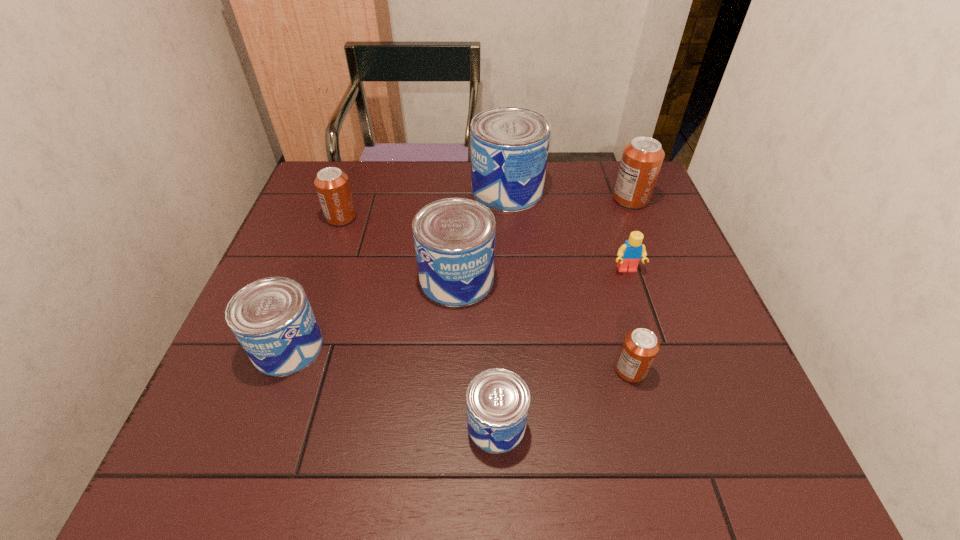
Choose which orange can is the nearest neighbor to the yellow Lego. Please provide its 2D coordinates. Your answer should be formatted as a tuple, i.e. [(x, y)], where the tuple contains the x and y coordinates of a point satisfying the conditions above.

[(641, 161)]

Where is `the third closest orange can to the smallest blue can`? The height and width of the screenshot is (540, 960). the third closest orange can to the smallest blue can is located at coordinates 641,161.

The width and height of the screenshot is (960, 540). Find the location of `vacant point that satisfies the following two spatial constraints: 1. on the front-facing side of the Lego; 2. on the front label of the nearest can`. vacant point that satisfies the following two spatial constraints: 1. on the front-facing side of the Lego; 2. on the front label of the nearest can is located at coordinates (677, 425).

Locate an element on the screen. This screenshot has height=540, width=960. free space that satisfies the following two spatial constraints: 1. on the front label of the second orange can from right to left; 2. on the right side of the fourth nearest can is located at coordinates (452, 370).

Find the location of a particular element. This screenshot has width=960, height=540. vacant space that satisfies the following two spatial constraints: 1. on the front-facing side of the yellow Lego; 2. on the front label of the second smallest blue can is located at coordinates (652, 347).

Where is `vacant area in the image that satisfies the following two spatial constraints: 1. on the back side of the second orange can from right to left; 2. on the right side of the rightmost orange can`? The image size is (960, 540). vacant area in the image that satisfies the following two spatial constraints: 1. on the back side of the second orange can from right to left; 2. on the right side of the rightmost orange can is located at coordinates (584, 199).

Where is `vacant region that satisfies the following two spatial constraints: 1. on the front-facing side of the Lego; 2. on the front label of the nearest can`? This screenshot has height=540, width=960. vacant region that satisfies the following two spatial constraints: 1. on the front-facing side of the Lego; 2. on the front label of the nearest can is located at coordinates (677, 425).

Identify the location of vacant space that satisfies the following two spatial constraints: 1. on the front-facing side of the Lego; 2. on the front label of the second nearest blue can. The height and width of the screenshot is (540, 960). (652, 347).